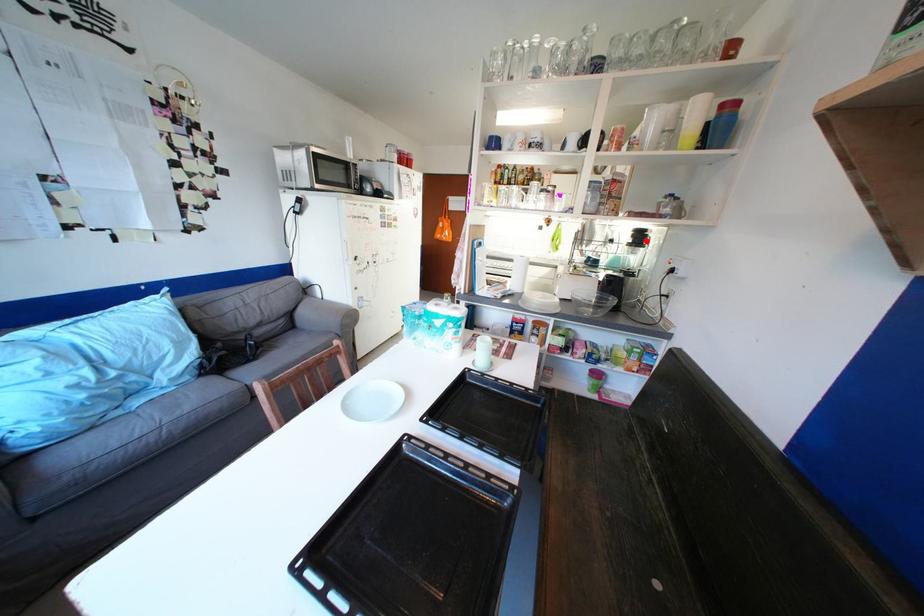
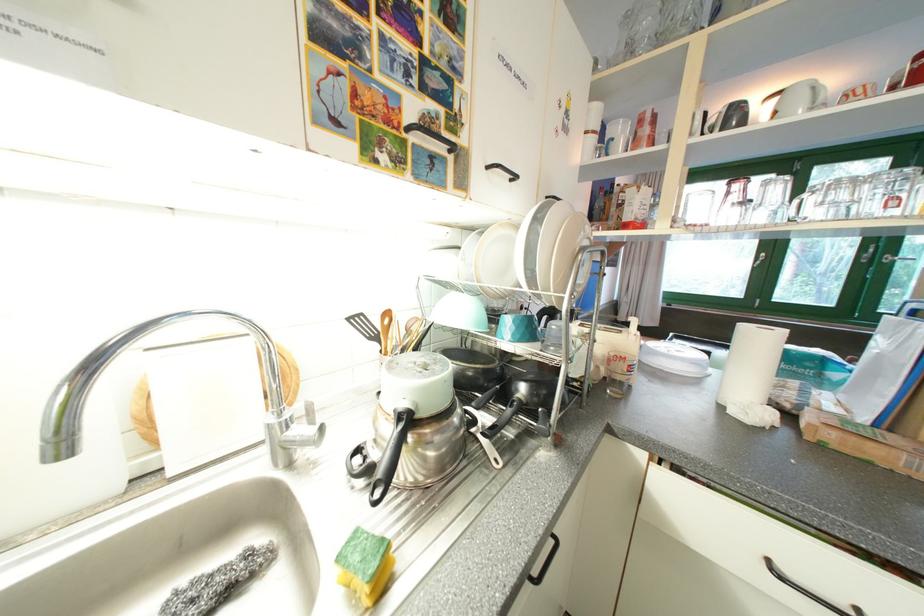
Question: I am providing you with two images of the same scene from different viewpoints. A red point is marked on the first image. At the location where the point appears in image 1, is it still visible in image 2?

Choices:
 (A) Yes
 (B) No

Answer: (B)